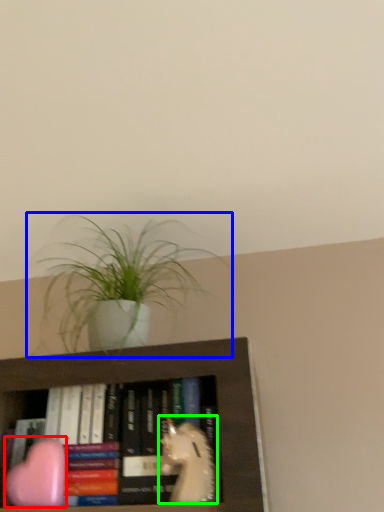
Question: Which object is the closest to the animal (highlighted by a red box)? Choose among these: houseplant (highlighted by a blue box) or animal (highlighted by a green box).

Choices:
 (A) houseplant
 (B) animal

Answer: (B)